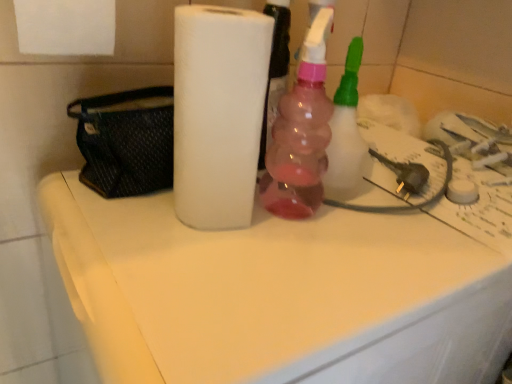
What do you see at coordinates (125, 142) in the screenshot?
I see `black mesh pouch at left` at bounding box center [125, 142].

Where is `pink translucent bottle at center`? pink translucent bottle at center is located at coordinates (301, 133).

Measure the distance between white matte paper towel at center and camera.

white matte paper towel at center is 14.98 inches away from camera.

This screenshot has width=512, height=384. What are the coordinates of `white matte paper towel at center` in the screenshot? It's located at (218, 112).

Find the location of a particular element. black mesh pouch at left is located at coordinates (125, 142).

Which is in front, point (91, 141) or point (315, 261)?

The point (315, 261) is closer to the camera.

Considering the positions of objects black mesh pouch at left and white matte counter top at center in the image provided, who is more to the right, black mesh pouch at left or white matte counter top at center?

white matte counter top at center.

Looking at this image, between black mesh pouch at left and white matte counter top at center, which one has larger width?

Wider between the two is white matte counter top at center.

Is black mesh pouch at left positioned with its back to white matte counter top at center?

That's not correct — black mesh pouch at left is not looking away from white matte counter top at center.

Is white matte counter top at center completely or partially outside of black mesh pouch at left?

Yes, white matte counter top at center is not within black mesh pouch at left.

Can you confirm if white matte counter top at center is positioned to the left of black mesh pouch at left?

No, white matte counter top at center is not to the left of black mesh pouch at left.

Which object is further away from the camera taking this photo, white matte counter top at center or black mesh pouch at left?

black mesh pouch at left is behind.

Could you tell me if pink translucent bottle at center is turned towards black mesh pouch at left?

No, pink translucent bottle at center is not oriented towards black mesh pouch at left.

Is pink translucent bottle at center inside the boundaries of black mesh pouch at left, or outside?

pink translucent bottle at center is outside black mesh pouch at left.

From the image's perspective, would you say pink translucent bottle at center is positioned over black mesh pouch at left?

Yes, from the image's perspective, pink translucent bottle at center is over black mesh pouch at left.

Where is `bottle above the black mesh pouch at left (from a real-world perspective)`? bottle above the black mesh pouch at left (from a real-world perspective) is located at coordinates (301, 133).

From the image's perspective, is pink translucent bottle at center positioned above or below white matte counter top at center?

From the image's perspective, pink translucent bottle at center appears above white matte counter top at center.

Is white matte counter top at center a part of pink translucent bottle at center?

No, white matte counter top at center is not surrounded by pink translucent bottle at center.

In the image, is pink translucent bottle at center positioned in front of or behind white matte counter top at center?

Visually, pink translucent bottle at center is located behind white matte counter top at center.

Are pink translucent bottle at center and white matte counter top at center far apart?

No, pink translucent bottle at center is in close proximity to white matte counter top at center.

Which is more to the right, black mesh pouch at left or white matte paper towel at center?

white matte paper towel at center is more to the right.

From the image's perspective, is black mesh pouch at left located beneath white matte paper towel at center?

Yes.

Is black mesh pouch at left wider than white matte paper towel at center?

Yes.

This screenshot has height=384, width=512. In order to click on counter top below the white matte paper towel at center (from a real-world perspective) in this screenshot , I will do `click(278, 294)`.

Considering the positions of objects white matte counter top at center and white matte paper towel at center in the image provided, who is more to the right, white matte counter top at center or white matte paper towel at center?

white matte counter top at center.

Considering the sizes of objects white matte counter top at center and white matte paper towel at center in the image provided, who is shorter, white matte counter top at center or white matte paper towel at center?

white matte paper towel at center is shorter.

In the scene shown: From the image's perspective, between white matte counter top at center and white matte paper towel at center, who is located below?

white matte counter top at center is shown below in the image.

From the image's perspective, which one is positioned higher, white matte counter top at center or pink translucent bottle at center?

pink translucent bottle at center.

Between white matte counter top at center and pink translucent bottle at center, which one has smaller size?

With smaller size is pink translucent bottle at center.

Is white matte counter top at center turned away from pink translucent bottle at center?

No.

Can you confirm if white matte counter top at center is taller than pink translucent bottle at center?

Yes, white matte counter top at center is taller than pink translucent bottle at center.

The image size is (512, 384). Identify the location of pouch behind the white matte counter top at center. (125, 142).

Locate an element on the screen. pouch above the white matte counter top at center (from a real-world perspective) is located at coordinates click(x=125, y=142).

Looking at the image, which one is located further to pink translucent bottle at center, white matte counter top at center or white matte paper towel at center?

Based on the image, white matte counter top at center appears to be further to pink translucent bottle at center.

Estimate the real-world distances between objects in this image. Which object is closer to white matte paper towel at center, black mesh pouch at left or pink translucent bottle at center?

black mesh pouch at left.

Considering their positions, is pink translucent bottle at center positioned closer to black mesh pouch at left than white matte counter top at center?

pink translucent bottle at center lies closer to black mesh pouch at left than the other object.

Estimate the real-world distances between objects in this image. Which object is further from white matte counter top at center, black mesh pouch at left or pink translucent bottle at center?

Among the two, black mesh pouch at left is located further to white matte counter top at center.

From the image, which object appears to be nearer to white matte counter top at center, black mesh pouch at left or white matte paper towel at center?

Among the two, white matte paper towel at center is located nearer to white matte counter top at center.

From the picture: Estimate the real-world distances between objects in this image. Which object is closer to black mesh pouch at left, white matte counter top at center or pink translucent bottle at center?

pink translucent bottle at center.

Looking at the image, which one is located closer to white matte paper towel at center, white matte counter top at center or pink translucent bottle at center?

pink translucent bottle at center is positioned closer to the anchor white matte paper towel at center.

Which object lies nearer to the anchor point pink translucent bottle at center, white matte paper towel at center or black mesh pouch at left?

white matte paper towel at center is positioned closer to the anchor pink translucent bottle at center.

This screenshot has height=384, width=512. What are the coordinates of `paper towel between pink translucent bottle at center and white matte counter top at center in the up-down direction` in the screenshot? It's located at point(218,112).

You are a GUI agent. You are given a task and a screenshot of the screen. Output one action in this format:
    pyautogui.click(x=<x>, y=<y>)
    Task: Click on the paper towel between black mesh pouch at left and pink translucent bottle at center
    
    Given the screenshot: What is the action you would take?
    pyautogui.click(x=218, y=112)

Where is `pouch between white matte paper towel at center and white matte counter top at center vertically`? The image size is (512, 384). pouch between white matte paper towel at center and white matte counter top at center vertically is located at coordinates (125, 142).

Where is `pouch between pink translucent bottle at center and white matte counter top at center vertically`? pouch between pink translucent bottle at center and white matte counter top at center vertically is located at coordinates (125, 142).